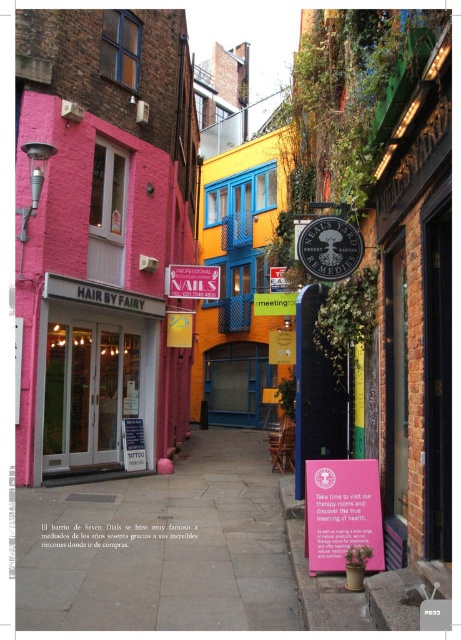
Question: Does matte white door at center appear on the left side of pink paper sign at center?

Choices:
 (A) yes
 (B) no

Answer: (A)

Question: Which point is closer to the camera?

Choices:
 (A) (252, 456)
 (B) (94, 445)
 (C) (175, 289)
 (D) (355, 504)

Answer: (D)

Question: Is pink paper sign at center thinner than metallic silver sign at center?

Choices:
 (A) no
 (B) yes

Answer: (B)

Question: Which of the following is the farthest from the observer?

Choices:
 (A) pink paper sign at center
 (B) smooth concrete pavement at center
 (C) matte white door at center
 (D) metallic silver sign at center

Answer: (D)

Question: Is smooth concrete pavement at center thinner than matte white door at center?

Choices:
 (A) no
 (B) yes

Answer: (A)

Question: Which of the following is the closest to the observer?

Choices:
 (A) smooth concrete pavement at center
 (B) metallic silver sign at center
 (C) matte white door at center
 (D) pink paper sign at center

Answer: (A)